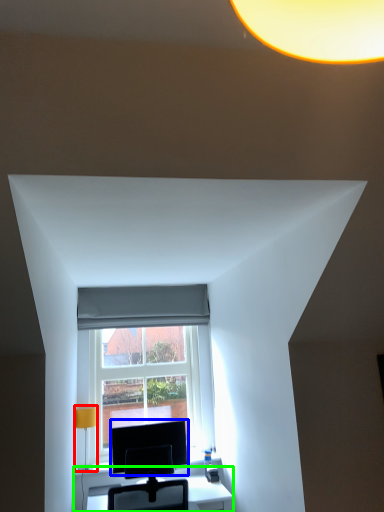
Question: Which object is the farthest from table lamp (highlighted by a red box)? Choose among these: computer monitor (highlighted by a blue box) or table (highlighted by a green box).

Choices:
 (A) computer monitor
 (B) table

Answer: (B)